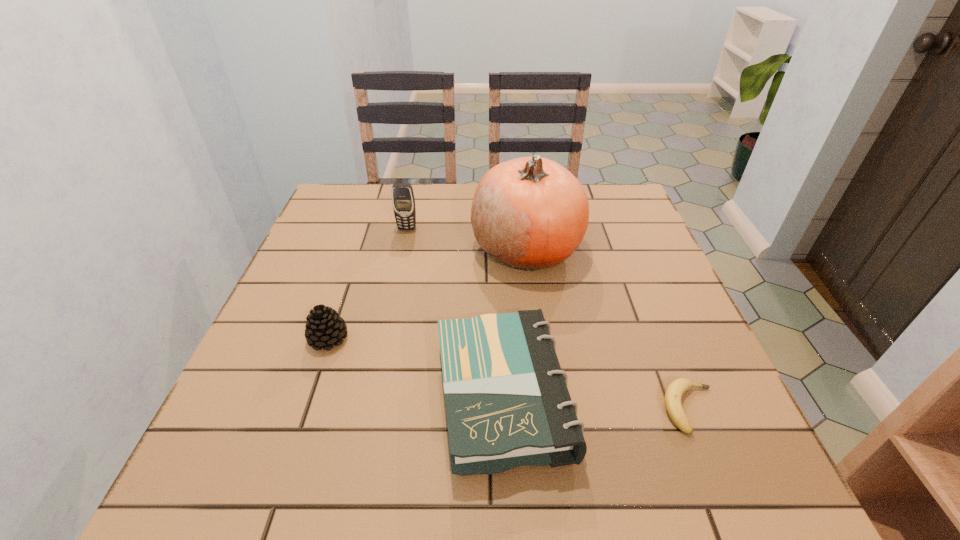
Where is `free space between the rightmost object and the tallest object`? The image size is (960, 540). free space between the rightmost object and the tallest object is located at coordinates (609, 328).

The image size is (960, 540). In order to click on blank region between the shortest object and the paperback book in this screenshot , I will do `click(596, 403)`.

The width and height of the screenshot is (960, 540). I want to click on empty location between the tallest object and the leftmost object, so click(x=427, y=293).

Choose which object is the third nearest neighbor to the pumpkin. Please provide its 2D coordinates. Your answer should be formatted as a tuple, i.e. [(x, y)], where the tuple contains the x and y coordinates of a point satisfying the conditions above.

[(324, 327)]

This screenshot has height=540, width=960. I want to click on the closest object to the cellular telephone, so click(530, 213).

Where is `free space that satisfies the following two spatial constraints: 1. on the front face of the second object from left to right; 2. on the left side of the banana`? free space that satisfies the following two spatial constraints: 1. on the front face of the second object from left to right; 2. on the left side of the banana is located at coordinates (368, 408).

I want to click on vacant space that satisfies the following two spatial constraints: 1. at the narrow end of the paperback book; 2. on the left side of the pinecone, so click(x=308, y=397).

Identify the location of vacant space that satisfies the following two spatial constraints: 1. on the front face of the paperback book; 2. on the right side of the cellular telephone. coord(371,397).

Where is `vacant area that satisfies the following two spatial constraints: 1. on the front face of the second tallest object; 2. on the right side of the tallest object`? The image size is (960, 540). vacant area that satisfies the following two spatial constraints: 1. on the front face of the second tallest object; 2. on the right side of the tallest object is located at coordinates (403, 248).

Locate an element on the screen. This screenshot has width=960, height=540. free space that satisfies the following two spatial constraints: 1. on the back side of the paperback book; 2. on the right side of the tallest object is located at coordinates (496, 248).